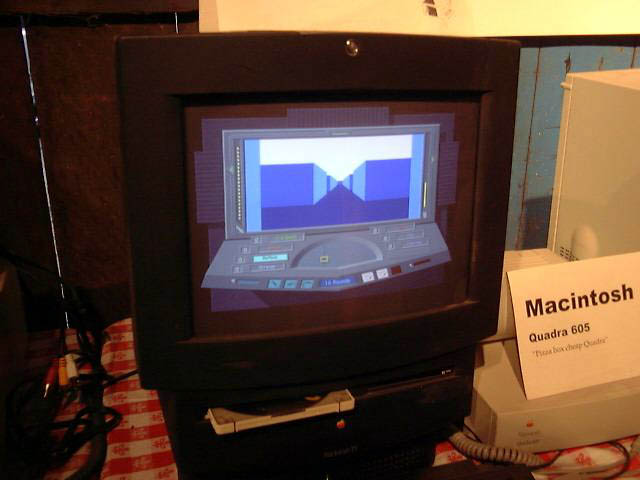
Where is `screen`? The image size is (640, 480). screen is located at coordinates (210, 201).